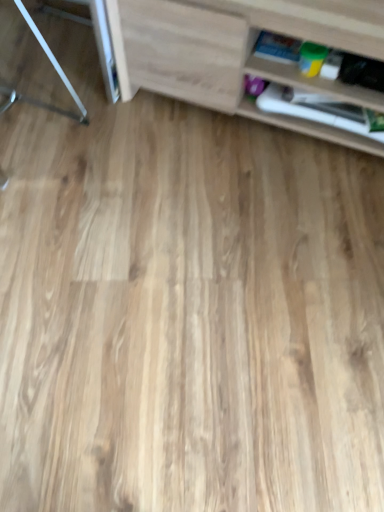
Where is `free space on the front side of light wood cabinet at upper right, placed as the 1th shelf when sorted from front to back`? Image resolution: width=384 pixels, height=512 pixels. free space on the front side of light wood cabinet at upper right, placed as the 1th shelf when sorted from front to back is located at coordinates (239, 242).